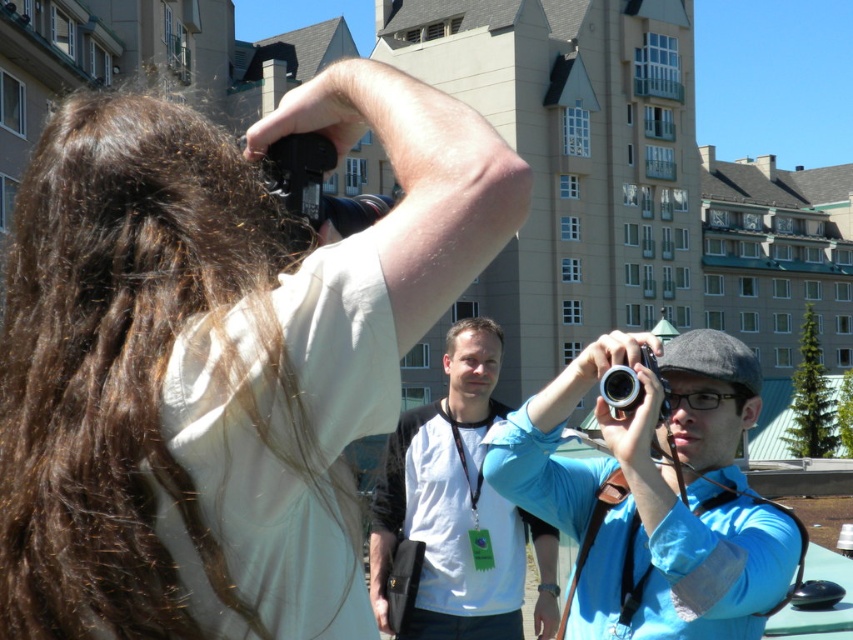
Based on the scene description, where is the matte white shirt at upper left located in the image?

The matte white shirt at upper left is located at point (x=218, y=356).

You are a photographer trying to set up a tripod at point (316,186). Is there already an object at that location?

Yes, there is a black plastic camera at upper center located at point (316,186).

You are a photographer trying to frame a shot. You notice the white matte shirt at center and the black plastic camera at upper center in your viewfinder. Which object should you adjust your focus to ensure the wider one is in the foreground?

The white matte shirt at center is wider than the black plastic camera at upper center, so you should focus on the white matte shirt at center to ensure the wider object is in the foreground.